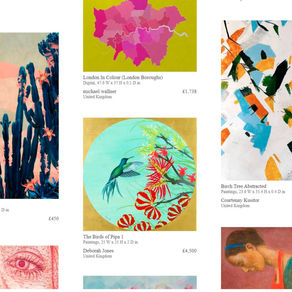
Locate an element on the screen. artwork / painting is located at coordinates (31, 271).